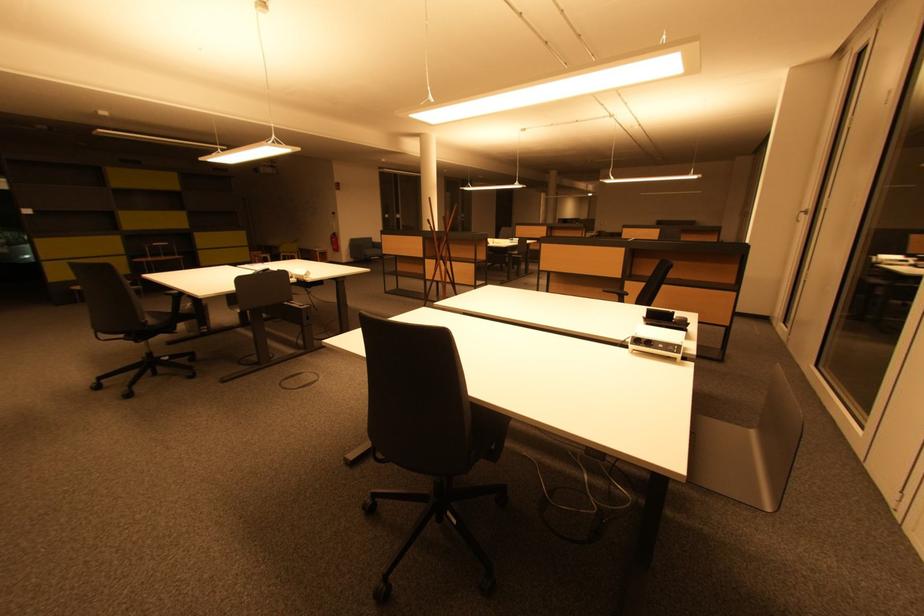
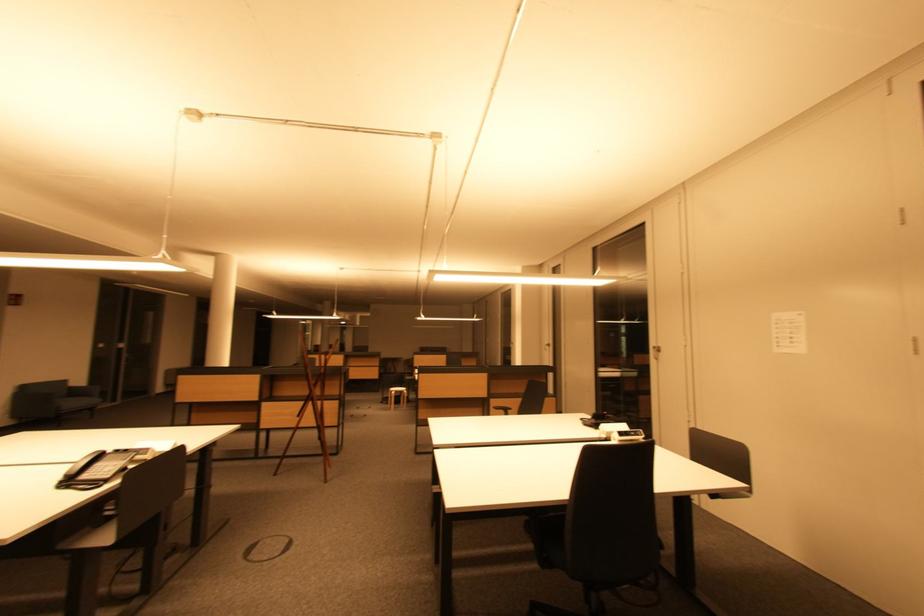
Find the pixel in the second image that matches pixel 661 323 in the first image.

(606, 424)